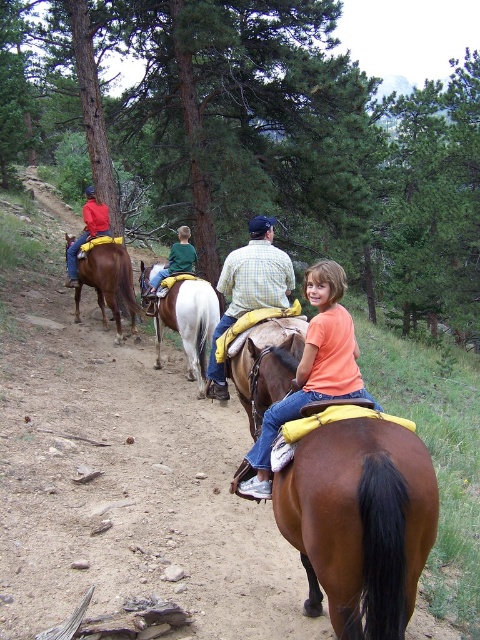
You are a photographer trying to capture the young girl in the matte orange shirt at center while avoiding the tall pine trees in the background. Based on the coordinates provided, can you position yourself so that the girl is in the frame without the trees obstructing her?

The matte orange shirt at center is located at point (310, 372), which means it is positioned in the central area of the image. Since the tall pine trees are in the background, adjusting the camera angle slightly downward or sideways could keep the girl centered while avoiding the trees behind her.

You are a photographer standing at the edge of the trail. You want to capture a photo of the checkered fabric shirt at center and the brown leather saddle at left in the same frame. Given that your camera has a maximum focus range of 10 feet, will both subjects be in focus?

The distance between the checkered fabric shirt at center and the brown leather saddle at left is 11.38 feet, which exceeds the camera focus range of 10 feet. Therefore, both subjects cannot be in focus simultaneously.

You are a photographer positioned at the origin point of the image. You want to capture a closeup shot of the brown leather saddle at left. Given that the saddle is located at coordinates point 0.444, 0.227, will you need to adjust your camera position to frame it properly?

The brown leather saddle at left is located at point (108, 284), so you will need to adjust your camera position to frame it properly since it is not centered at the origin point.